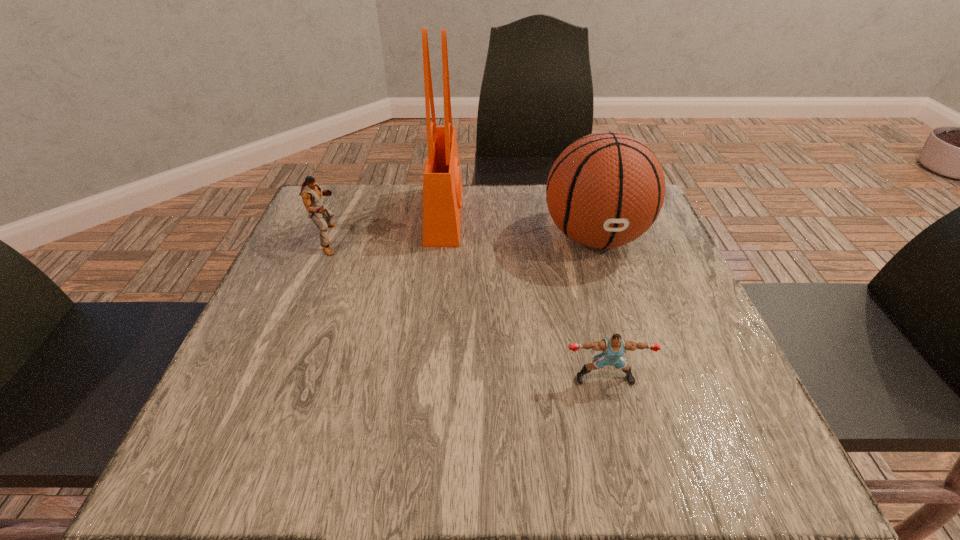
In the image, there is a desktop. Identify the location of vacant space at the near edge. This screenshot has height=540, width=960. (555, 466).

Image resolution: width=960 pixels, height=540 pixels. I want to click on blank space at the left edge, so click(x=213, y=412).

In the image, there is a desktop. Where is `vacant space at the right edge`? The height and width of the screenshot is (540, 960). vacant space at the right edge is located at coordinates (677, 303).

This screenshot has width=960, height=540. In the image, there is a desktop. Identify the location of blank space at the near left corner. (277, 470).

In the image, there is a desktop. At what (x,y) coordinates should I click in order to perform the action: click on free space at the near right corner. Please return your answer as a coordinate pair (x, y). Looking at the image, I should click on (724, 440).

At what (x,y) coordinates should I click in order to perform the action: click on free spot between the shortest object and the farther puncher. Please return your answer as a coordinate pair (x, y). The width and height of the screenshot is (960, 540). Looking at the image, I should click on (467, 309).

The width and height of the screenshot is (960, 540). What are the coordinates of `free point between the nearest object and the farther puncher` in the screenshot? It's located at (467, 309).

At what (x,y) coordinates should I click in order to perform the action: click on vacant point located between the nearer puncher and the second object from left to right. Please return your answer as a coordinate pair (x, y). The image size is (960, 540). Looking at the image, I should click on (524, 296).

Locate an element on the screen. vacant region between the third object from right to left and the shorter puncher is located at coordinates (524, 296).

The height and width of the screenshot is (540, 960). In order to click on free space between the tote bag and the third shortest object in this screenshot , I will do `click(519, 226)`.